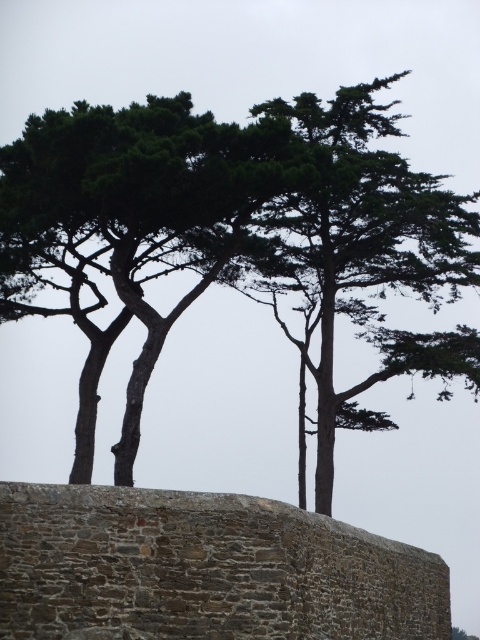
Question: Which of the following is the closest to the observer?

Choices:
 (A) brown stone wall at center
 (B) green textured tree at center

Answer: (A)

Question: Which point is farther to the camera?

Choices:
 (A) (98, 179)
 (B) (218, 497)

Answer: (A)

Question: Which object is farther from the camera taking this photo?

Choices:
 (A) brown stone wall at center
 (B) green textured tree at center

Answer: (B)

Question: In this image, where is brown stone wall at center located relative to green textured tree at upper center?

Choices:
 (A) above
 (B) below

Answer: (B)

Question: Does brown stone wall at center have a smaller size compared to green textured tree at center?

Choices:
 (A) yes
 (B) no

Answer: (A)

Question: Does brown stone wall at center have a larger size compared to green textured tree at center?

Choices:
 (A) yes
 (B) no

Answer: (B)